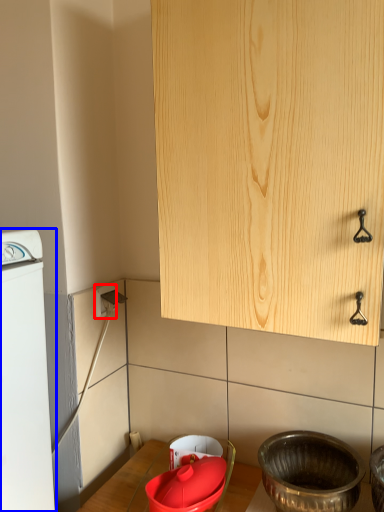
Question: Among these objects, which one is nearest to the camera, electric outlet (highlighted by a red box) or home appliance (highlighted by a blue box)?

Choices:
 (A) electric outlet
 (B) home appliance

Answer: (B)